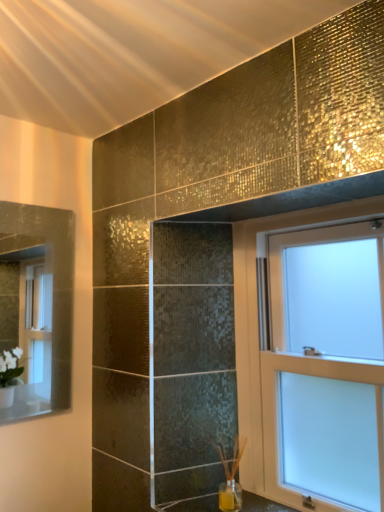
What do you see at coordinates (37, 306) in the screenshot? I see `clear glass mirror at left` at bounding box center [37, 306].

In order to face clear glass mirror at left, should I rotate leftwards or rightwards?

Rotate left and turn 19.437 degrees.

The width and height of the screenshot is (384, 512). In order to click on clear glass mirror at left in this screenshot , I will do `click(37, 306)`.

Describe the element at coordinates (326, 368) in the screenshot. Image resolution: width=384 pixels, height=512 pixels. I see `white frosted glass window at upper right` at that location.

The width and height of the screenshot is (384, 512). I want to click on white frosted glass window at upper right, so click(326, 368).

This screenshot has width=384, height=512. I want to click on clear glass mirror at left, so click(x=37, y=306).

In the scene shown: Is white frosted glass window at upper right at the left side of clear glass mirror at left?

Incorrect, white frosted glass window at upper right is not on the left side of clear glass mirror at left.

Considering their positions, is white frosted glass window at upper right located in front of or behind clear glass mirror at left?

Visually, white frosted glass window at upper right is located in front of clear glass mirror at left.

Is point (378, 344) positioned behind point (2, 281)?

No, it is not.

From the image's perspective, is white frosted glass window at upper right beneath clear glass mirror at left?

Yes.

From a real-world perspective, who is located lower, white frosted glass window at upper right or clear glass mirror at left?

white frosted glass window at upper right is physically lower.

Which object is thinner, white frosted glass window at upper right or clear glass mirror at left?

With smaller width is clear glass mirror at left.

Who is shorter, white frosted glass window at upper right or clear glass mirror at left?

With less height is clear glass mirror at left.

Between white frosted glass window at upper right and clear glass mirror at left, which one has smaller size?

clear glass mirror at left.

Is white frosted glass window at upper right situated inside clear glass mirror at left or outside?

The correct answer is: outside.

Would you consider white frosted glass window at upper right to be distant from clear glass mirror at left?

Yes, white frosted glass window at upper right and clear glass mirror at left are located far from each other.

Could you tell me if white frosted glass window at upper right is facing clear glass mirror at left?

No, white frosted glass window at upper right is not oriented towards clear glass mirror at left.

Based on the photo, how different are the orientations of white frosted glass window at upper right and clear glass mirror at left in degrees?

90.6 degrees separate the facing orientations of white frosted glass window at upper right and clear glass mirror at left.

How much distance is there between white frosted glass window at upper right and clear glass mirror at left?

white frosted glass window at upper right and clear glass mirror at left are 1.98 meters apart.

Image resolution: width=384 pixels, height=512 pixels. Find the location of `mirror behind the white frosted glass window at upper right`. mirror behind the white frosted glass window at upper right is located at coordinates [37, 306].

Based on their positions, is clear glass mirror at left located to the left or right of white frosted glass window at upper right?

From the image, it's evident that clear glass mirror at left is to the left of white frosted glass window at upper right.

Considering the relative positions of clear glass mirror at left and white frosted glass window at upper right in the image provided, is clear glass mirror at left in front of white frosted glass window at upper right?

No, the depth of clear glass mirror at left is greater than that of white frosted glass window at upper right.

Does point (34, 359) appear closer or farther from the camera than point (356, 414)?

Point (34, 359).

Consider the image. From the image's perspective, between clear glass mirror at left and white frosted glass window at upper right, who is located below?

From the image's view, white frosted glass window at upper right is below.

From a real-world perspective, is clear glass mirror at left physically below white frosted glass window at upper right?

Incorrect, from a real-world perspective, clear glass mirror at left is higher than white frosted glass window at upper right.

Based on the photo, is clear glass mirror at left wider or thinner than white frosted glass window at upper right?

Considering their sizes, clear glass mirror at left looks slimmer than white frosted glass window at upper right.

In terms of height, does clear glass mirror at left look taller or shorter compared to white frosted glass window at upper right?

Clearly, clear glass mirror at left is shorter compared to white frosted glass window at upper right.

Which of these two, clear glass mirror at left or white frosted glass window at upper right, is smaller?

With smaller size is clear glass mirror at left.

Would you say clear glass mirror at left contains white frosted glass window at upper right?

No, clear glass mirror at left does not contain white frosted glass window at upper right.

Are clear glass mirror at left and white frosted glass window at upper right beside each other?

No, clear glass mirror at left is not beside white frosted glass window at upper right.

Does clear glass mirror at left turn towards white frosted glass window at upper right?

No, clear glass mirror at left is not oriented towards white frosted glass window at upper right.

How many degrees apart are the facing directions of clear glass mirror at left and white frosted glass window at upper right?

They differ by 90.6 degrees in their facing directions.

At what (x,y) coordinates should I click in order to perform the action: click on window located underneath the clear glass mirror at left (from a real-world perspective). Please return your answer as a coordinate pair (x, y). Looking at the image, I should click on (326, 368).

Locate an element on the screen. The image size is (384, 512). mirror above the white frosted glass window at upper right (from the image's perspective) is located at coordinates (37, 306).

At what (x,y) coordinates should I click in order to perform the action: click on mirror above the white frosted glass window at upper right (from a real-world perspective). Please return your answer as a coordinate pair (x, y). This screenshot has height=512, width=384. Looking at the image, I should click on (37, 306).